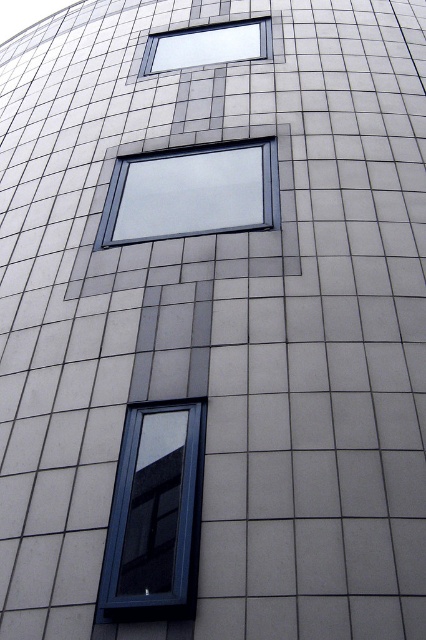
You are an architect designing a new building and want to ensure that the windows align with the building aesthetic. Given the matte glass window at center and the matte glass window at upper center, which one has a greater width?

The matte glass window at upper center has a greater width than the matte glass window at center.

You are an architect reviewing the building facade. You need to install a new sensor on the wall between the matte black window at lower left and the matte glass window at center. Can you fit it there?

The matte black window at lower left is positioned under the matte glass window at center, so there is space between them where the sensor can be installed.